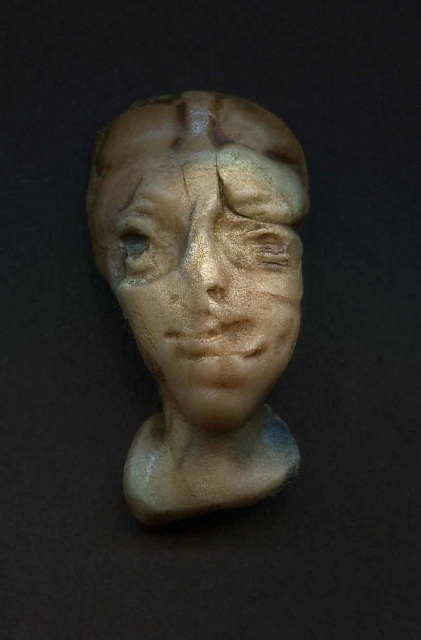
Question: Which of the following is the closest to the observer?

Choices:
 (A) (141, 259)
 (B) (133, 196)
 (C) (210, 132)

Answer: (C)

Question: Considering the relative positions of matte gold bust at center and matte brown eyebrow at center in the image provided, where is matte gold bust at center located with respect to matte brown eyebrow at center?

Choices:
 (A) right
 (B) left

Answer: (A)

Question: Which point appears farthest from the camera in this image?

Choices:
 (A) (234, 147)
 (B) (128, 253)
 (C) (277, 428)
 (D) (135, 182)

Answer: (C)

Question: Which object appears farthest from the camera in this image?

Choices:
 (A) matte brown eyebrow at center
 (B) matte brown eye at center
 (C) matte gold bust at center

Answer: (B)

Question: Can you confirm if shiny metallic forehead at center is positioned below matte brown eyebrow at center?

Choices:
 (A) no
 (B) yes

Answer: (A)

Question: Is matte gold bust at center below matte brown eye at center?

Choices:
 (A) yes
 (B) no

Answer: (A)